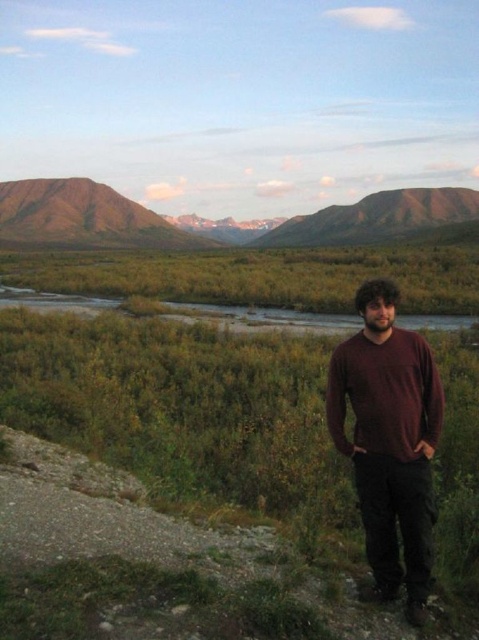
Does rugged brown mountain at upper left come behind brown rocky mountain at upper center?

Yes, rugged brown mountain at upper left is behind brown rocky mountain at upper center.

Which is more to the left, rugged brown mountain at upper left or brown rocky mountain at upper center?

rugged brown mountain at upper left

You are a GUI agent. You are given a task and a screenshot of the screen. Output one action in this format:
    pyautogui.click(x=<x>, y=<y>)
    Task: Click on the rugged brown mountain at upper left
    Image resolution: width=479 pixels, height=640 pixels.
    Given the screenshot: What is the action you would take?
    pyautogui.click(x=83, y=218)

Does green grassy wetland at center have a smaller size compared to maroon sweater at center?

Incorrect, green grassy wetland at center is not smaller in size than maroon sweater at center.

Which is below, green grassy wetland at center or maroon sweater at center?

Positioned lower is maroon sweater at center.

Is point (163, 412) positioned after point (384, 300)?

Yes, it is.

This screenshot has height=640, width=479. I want to click on green grassy wetland at center, so click(x=190, y=416).

Who is positioned more to the right, green grassy wetland at center or brown rocky mountain at upper center?

brown rocky mountain at upper center

Who is taller, green grassy wetland at center or brown rocky mountain at upper center?

brown rocky mountain at upper center is taller.

What do you see at coordinates (190, 416) in the screenshot? This screenshot has width=479, height=640. I see `green grassy wetland at center` at bounding box center [190, 416].

Where is `green grassy wetland at center`? The height and width of the screenshot is (640, 479). green grassy wetland at center is located at coordinates (190, 416).